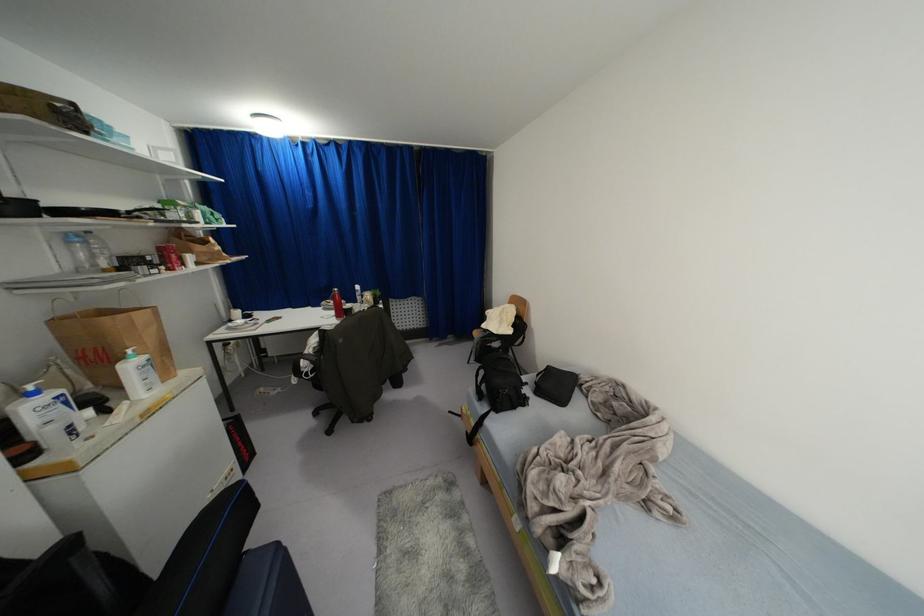
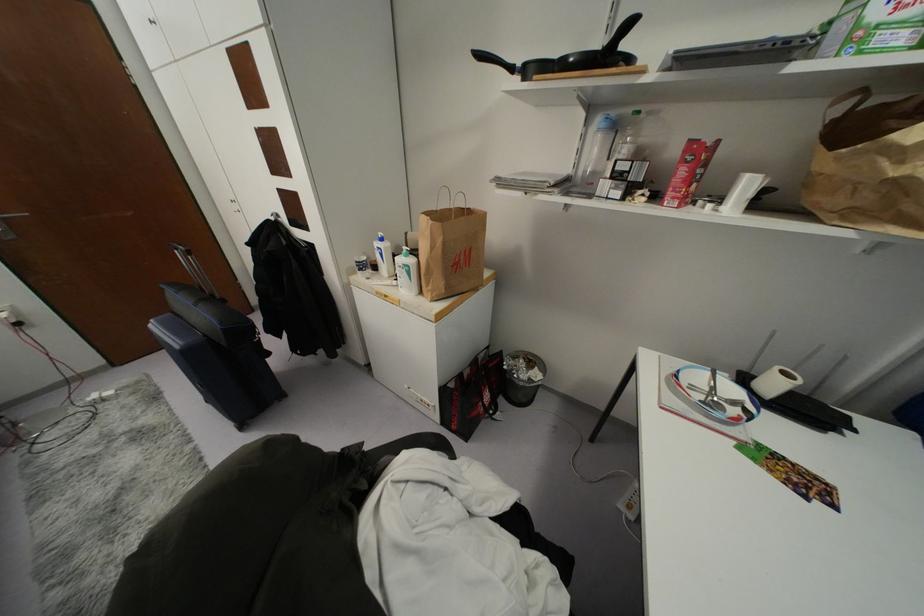
Question: I am providing you with two images of the same scene from different viewpoints. Please identify which objects are invisible in image2.

Choices:
 (A) paper towel roll
 (B) black pan handle
 (C) white bottle pump
 (D) none of these

Answer: (D)